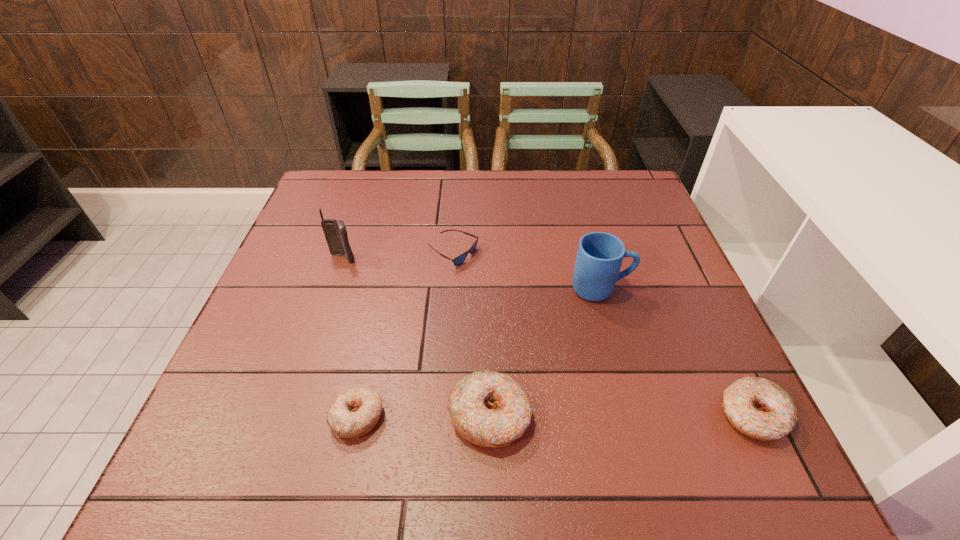
I want to click on free region that satisfies the following two spatial constraints: 1. on the keyboard of the leftmost object; 2. on the left side of the rightmost doughnut, so click(x=291, y=415).

This screenshot has width=960, height=540. Find the location of `free location that satisfies the following two spatial constraints: 1. at the front of the sunglasses showing the lenses; 2. on the right side of the tallest doughnut`. free location that satisfies the following two spatial constraints: 1. at the front of the sunglasses showing the lenses; 2. on the right side of the tallest doughnut is located at coordinates (443, 416).

Image resolution: width=960 pixels, height=540 pixels. Identify the location of blank space that satisfies the following two spatial constraints: 1. on the side of the rightmost object with the handle; 2. on the right side of the fourth nearest object. (636, 415).

The width and height of the screenshot is (960, 540). Find the location of `vacant area that satisfies the following two spatial constraints: 1. on the side of the rightmost doughnut with the handle; 2. on the left side of the mug`. vacant area that satisfies the following two spatial constraints: 1. on the side of the rightmost doughnut with the handle; 2. on the left side of the mug is located at coordinates (636, 415).

I want to click on vacant space that satisfies the following two spatial constraints: 1. on the keyboard of the rightmost object; 2. on the left side of the cellular telephone, so click(291, 415).

Where is `free space that satisfies the following two spatial constraints: 1. at the front of the sunglasses showing the lenses; 2. on the keyboard of the leftmost object`? free space that satisfies the following two spatial constraints: 1. at the front of the sunglasses showing the lenses; 2. on the keyboard of the leftmost object is located at coordinates (453, 259).

Where is `vacant position in the image that satisfies the following two spatial constraints: 1. on the keyboard of the leftmost object; 2. on the left side of the rightmost doughnut`? The width and height of the screenshot is (960, 540). vacant position in the image that satisfies the following two spatial constraints: 1. on the keyboard of the leftmost object; 2. on the left side of the rightmost doughnut is located at coordinates (291, 415).